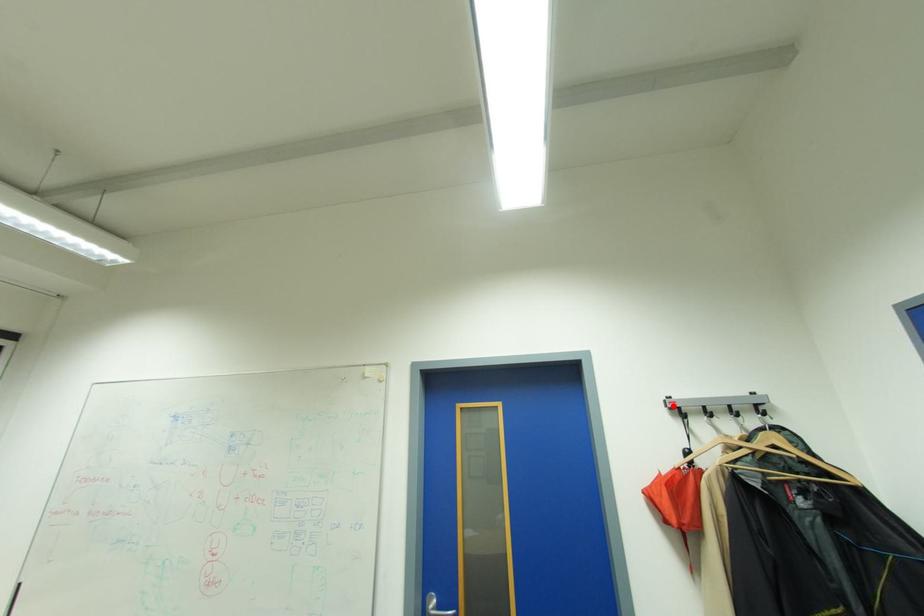
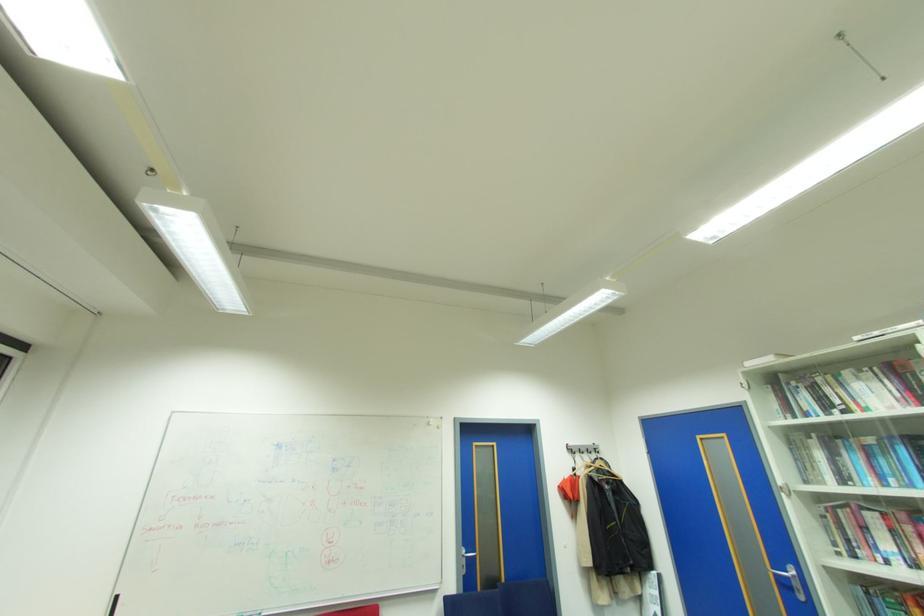
Question: I am providing you with two images of the same scene from different viewpoints. Given a red point in image1, look at the same physical point in image2. Is it:

Choices:
 (A) Closer to the viewpoint
 (B) Farther from the viewpoint

Answer: (B)